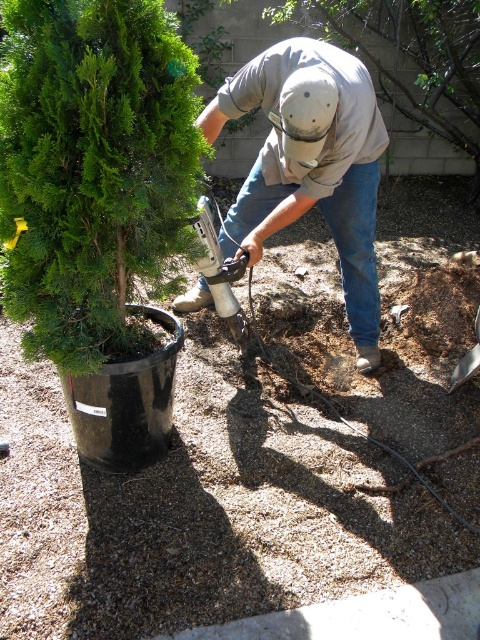
Question: Estimate the real-world distances between objects in this image. Which object is closer to the green matte shrub at left?

Choices:
 (A) gray fabric shirt at center
 (B) green matte tree at center

Answer: (A)

Question: Does green matte shrub at left appear on the right side of gray fabric shirt at center?

Choices:
 (A) no
 (B) yes

Answer: (A)

Question: Is green matte shrub at left above green matte tree at center?

Choices:
 (A) no
 (B) yes

Answer: (A)

Question: Observing the image, what is the correct spatial positioning of gray fabric shirt at center in reference to green matte tree at center?

Choices:
 (A) below
 (B) above

Answer: (A)

Question: Which point appears closest to the camera in this image?

Choices:
 (A) (261, 250)
 (B) (116, 36)

Answer: (B)

Question: Which point is closer to the camera?

Choices:
 (A) green matte shrub at left
 (B) green matte tree at center

Answer: (A)